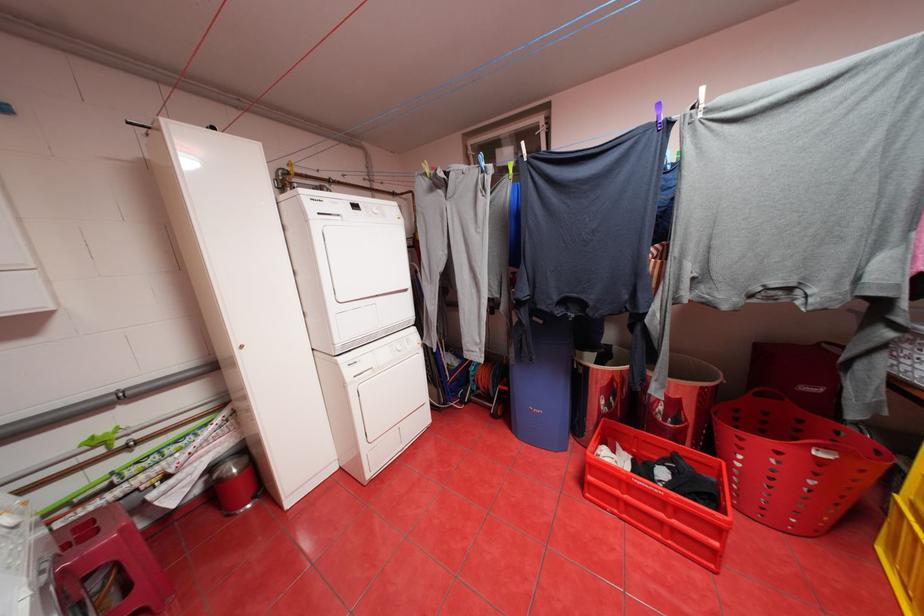
What do you see at coordinates (691, 377) in the screenshot?
I see `the red bin lid` at bounding box center [691, 377].